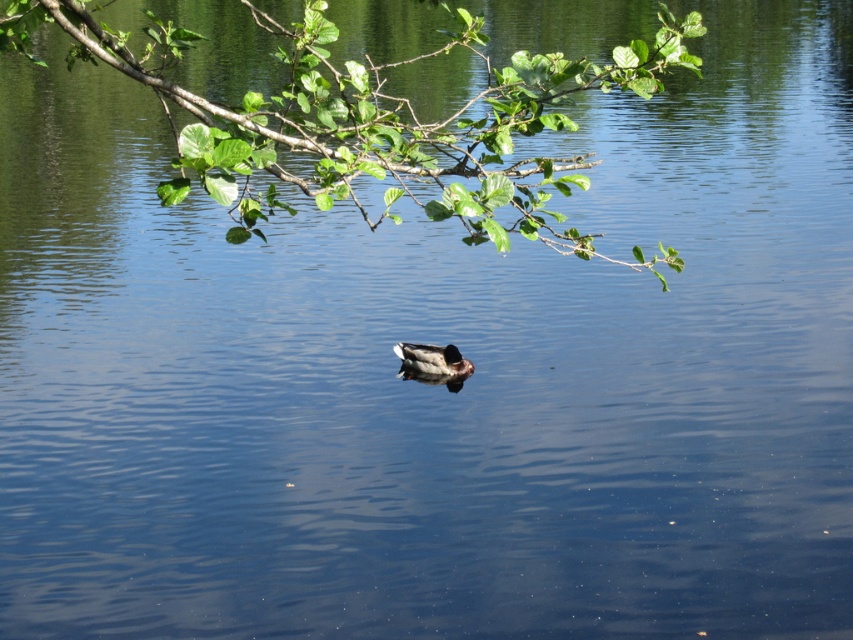
Can you confirm if green leafy branch at upper center is positioned above brown matte duck at center?

Indeed, green leafy branch at upper center is positioned over brown matte duck at center.

Does green leafy branch at upper center have a smaller size compared to brown matte duck at center?

Incorrect, green leafy branch at upper center is not smaller in size than brown matte duck at center.

Does point (253, 90) come in front of point (426, 364)?

No.

Where is `green leafy branch at upper center`? The width and height of the screenshot is (853, 640). green leafy branch at upper center is located at coordinates (372, 122).